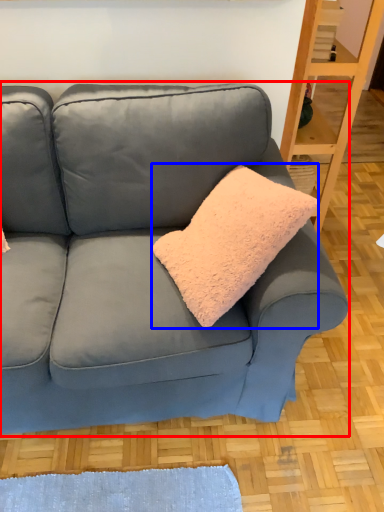
Question: Among these objects, which one is farthest to the camera, studio couch (highlighted by a red box) or throw pillow (highlighted by a blue box)?

Choices:
 (A) studio couch
 (B) throw pillow

Answer: (B)